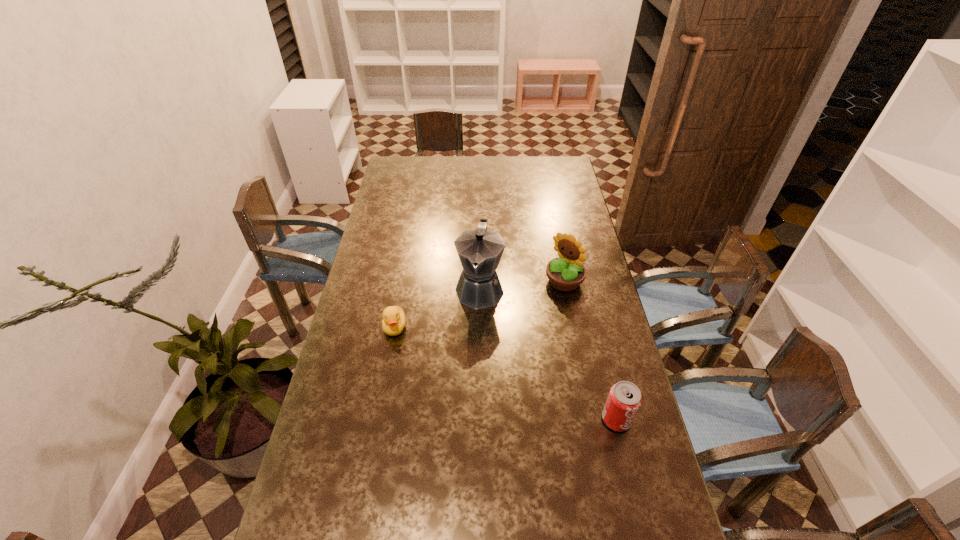
Image resolution: width=960 pixels, height=540 pixels. Find the location of `free space on the desktop that is between the leftmost object and the soda can and is positioned at the spout of the coffeepot`. free space on the desktop that is between the leftmost object and the soda can and is positioned at the spout of the coffeepot is located at coordinates (468, 357).

Identify the location of free spot on the desktop that is between the third farthest object and the third tallest object and is positioned on the face of the sunflower. (474, 360).